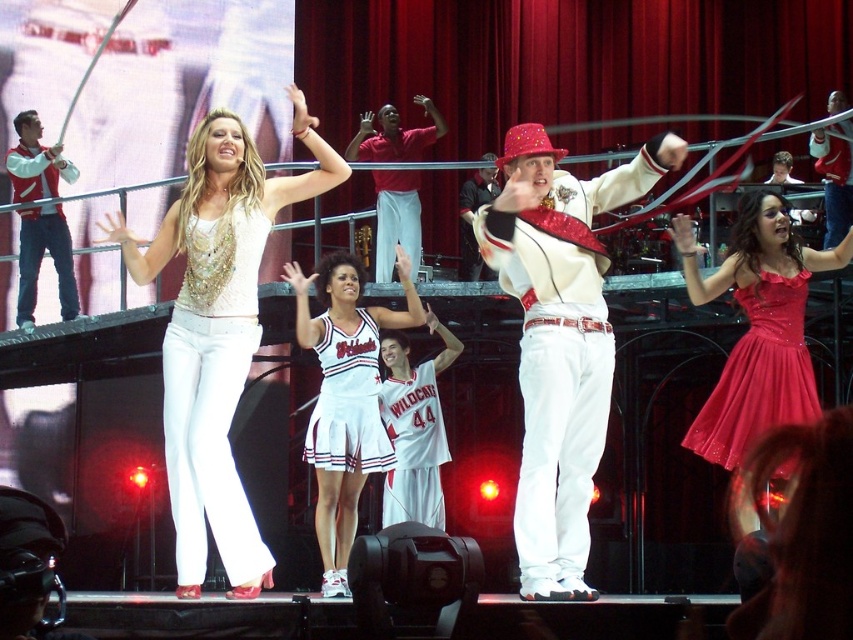
Who is shorter, shiny red dress at center or white fabric cheerleader outfit at center?

white fabric cheerleader outfit at center

This screenshot has height=640, width=853. I want to click on shiny red dress at center, so click(757, 326).

Consider the image. Who is higher up, shiny red dress at center or matte red shirt at center?

Positioned higher is matte red shirt at center.

Does point (846, 260) come behind point (386, 125)?

That is False.

Locate an element on the screen. This screenshot has width=853, height=640. shiny red dress at center is located at coordinates (757, 326).

Is point (799, 404) positioned behind point (30, 148)?

No, (799, 404) is in front of (30, 148).

Which of these two, shiny red dress at center or matte red vest at left, stands shorter?

matte red vest at left

Which is in front, point (727, 390) or point (18, 304)?

Point (727, 390) is in front.

The width and height of the screenshot is (853, 640). I want to click on shiny red dress at center, so click(757, 326).